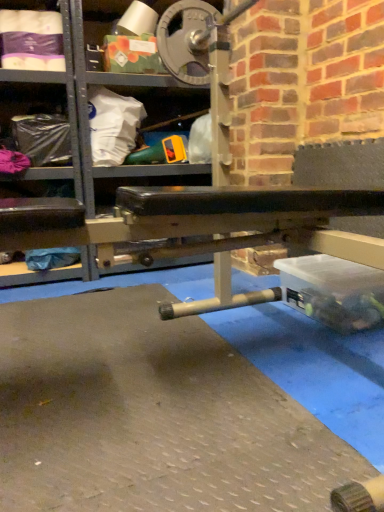
The image size is (384, 512). I want to click on black rubber bench at center, placed as the 1th shelf when sorted from right to left, so click(86, 114).

How much space does black rubber bench at center, placed as the 1th shelf when sorted from right to left, occupy horizontally?

The width of black rubber bench at center, placed as the 1th shelf when sorted from right to left, is 62.64 centimeters.

The width and height of the screenshot is (384, 512). What do you see at coordinates (86, 114) in the screenshot?
I see `black rubber bench at center, which is the second shelf in left-to-right order` at bounding box center [86, 114].

What is the approximate height of clear plastic bag at left, which ranks as the 2th shelf in right-to-left order?

clear plastic bag at left, which ranks as the 2th shelf in right-to-left order, is 11.15 inches in height.

Where is `clear plastic bag at left, which ranks as the 2th shelf in right-to-left order`? The height and width of the screenshot is (512, 384). clear plastic bag at left, which ranks as the 2th shelf in right-to-left order is located at coordinates (37, 121).

Measure the distance between point [29,158] and camera.

Point [29,158] is 1.96 meters from camera.

What do you see at coordinates (37, 121) in the screenshot? The height and width of the screenshot is (512, 384). I see `clear plastic bag at left, which ranks as the 2th shelf in right-to-left order` at bounding box center [37, 121].

Where is `black rubber bench at center, which is the second shelf in left-to-right order`? This screenshot has height=512, width=384. black rubber bench at center, which is the second shelf in left-to-right order is located at coordinates (86, 114).

In the scene shown: Can you confirm if black rubber bench at center, which is the second shelf in left-to-right order, is positioned to the left of clear plastic bag at left, which ranks as the 2th shelf in right-to-left order?

No.

Which object is further away from the camera taking this photo, black rubber bench at center, which is the second shelf in left-to-right order, or clear plastic bag at left, the 1th shelf when ordered from left to right?

clear plastic bag at left, the 1th shelf when ordered from left to right, is more distant.

Is point (51, 75) farther from viewer compared to point (13, 83)?

No, it is not.

From the image's perspective, is black rubber bench at center, which is the second shelf in left-to-right order, located above clear plastic bag at left, which ranks as the 2th shelf in right-to-left order?

Yes, from the image's perspective, black rubber bench at center, which is the second shelf in left-to-right order, is over clear plastic bag at left, which ranks as the 2th shelf in right-to-left order.

From a real-world perspective, is black rubber bench at center, placed as the 1th shelf when sorted from right to left, located higher than clear plastic bag at left, which ranks as the 2th shelf in right-to-left order?

Yes.

Between black rubber bench at center, placed as the 1th shelf when sorted from right to left, and clear plastic bag at left, which ranks as the 2th shelf in right-to-left order, which one has larger width?

Wider between the two is black rubber bench at center, placed as the 1th shelf when sorted from right to left.

Considering the sizes of black rubber bench at center, which is the second shelf in left-to-right order, and clear plastic bag at left, the 1th shelf when ordered from left to right, in the image, is black rubber bench at center, which is the second shelf in left-to-right order, taller or shorter than clear plastic bag at left, the 1th shelf when ordered from left to right,?

In the image, black rubber bench at center, which is the second shelf in left-to-right order, appears to be taller than clear plastic bag at left, the 1th shelf when ordered from left to right.

Considering the sizes of objects black rubber bench at center, which is the second shelf in left-to-right order, and clear plastic bag at left, which ranks as the 2th shelf in right-to-left order, in the image provided, who is smaller, black rubber bench at center, which is the second shelf in left-to-right order, or clear plastic bag at left, which ranks as the 2th shelf in right-to-left order,?

With smaller size is clear plastic bag at left, which ranks as the 2th shelf in right-to-left order.

Is black rubber bench at center, which is the second shelf in left-to-right order, not inside clear plastic bag at left, which ranks as the 2th shelf in right-to-left order?

Yes.

Is black rubber bench at center, placed as the 1th shelf when sorted from right to left, oriented away from clear plastic bag at left, which ranks as the 2th shelf in right-to-left order?

No, black rubber bench at center, placed as the 1th shelf when sorted from right to left, is not facing the opposite direction of clear plastic bag at left, which ranks as the 2th shelf in right-to-left order.

Identify the location of shelf lying on the right of clear plastic bag at left, the 1th shelf when ordered from left to right. The image size is (384, 512). (86, 114).

Would you say clear plastic bag at left, which ranks as the 2th shelf in right-to-left order, is to the left or to the right of black rubber bench at center, which is the second shelf in left-to-right order, in the picture?

clear plastic bag at left, which ranks as the 2th shelf in right-to-left order, is positioned on black rubber bench at center, which is the second shelf in left-to-right order,'s left side.

In the scene shown: Which object is further away from the camera taking this photo, clear plastic bag at left, the 1th shelf when ordered from left to right, or black rubber bench at center, placed as the 1th shelf when sorted from right to left?

clear plastic bag at left, the 1th shelf when ordered from left to right, is further away from the camera.

Does point (49, 161) lie behind point (40, 79)?

Yes, it is behind point (40, 79).

From the image's perspective, relative to black rubber bench at center, which is the second shelf in left-to-right order, is clear plastic bag at left, which ranks as the 2th shelf in right-to-left order, above or below?

clear plastic bag at left, which ranks as the 2th shelf in right-to-left order, is below black rubber bench at center, which is the second shelf in left-to-right order.

From a real-world perspective, is clear plastic bag at left, which ranks as the 2th shelf in right-to-left order, positioned above or below black rubber bench at center, which is the second shelf in left-to-right order?

A: clear plastic bag at left, which ranks as the 2th shelf in right-to-left order, is below black rubber bench at center, which is the second shelf in left-to-right order.

Which object is wider, clear plastic bag at left, the 1th shelf when ordered from left to right, or black rubber bench at center, which is the second shelf in left-to-right order?

black rubber bench at center, which is the second shelf in left-to-right order.

Considering the relative sizes of clear plastic bag at left, which ranks as the 2th shelf in right-to-left order, and black rubber bench at center, placed as the 1th shelf when sorted from right to left, in the image provided, is clear plastic bag at left, which ranks as the 2th shelf in right-to-left order, shorter than black rubber bench at center, placed as the 1th shelf when sorted from right to left,?

Indeed, clear plastic bag at left, which ranks as the 2th shelf in right-to-left order, has a lesser height compared to black rubber bench at center, placed as the 1th shelf when sorted from right to left.

Does clear plastic bag at left, which ranks as the 2th shelf in right-to-left order, have a smaller size compared to black rubber bench at center, placed as the 1th shelf when sorted from right to left?

Yes, clear plastic bag at left, which ranks as the 2th shelf in right-to-left order, is smaller than black rubber bench at center, placed as the 1th shelf when sorted from right to left.

Which is correct: clear plastic bag at left, the 1th shelf when ordered from left to right, is inside black rubber bench at center, which is the second shelf in left-to-right order, or outside of it?

clear plastic bag at left, the 1th shelf when ordered from left to right, lies outside black rubber bench at center, which is the second shelf in left-to-right order.

Is clear plastic bag at left, the 1th shelf when ordered from left to right, far away from black rubber bench at center, which is the second shelf in left-to-right order?

No, there isn't a large distance between clear plastic bag at left, the 1th shelf when ordered from left to right, and black rubber bench at center, which is the second shelf in left-to-right order.

Is clear plastic bag at left, the 1th shelf when ordered from left to right, oriented away from black rubber bench at center, which is the second shelf in left-to-right order?

No, black rubber bench at center, which is the second shelf in left-to-right order, is not at the back of clear plastic bag at left, the 1th shelf when ordered from left to right.

What's the angular difference between clear plastic bag at left, which ranks as the 2th shelf in right-to-left order, and black rubber bench at center, placed as the 1th shelf when sorted from right to left,'s facing directions?

The angular difference between clear plastic bag at left, which ranks as the 2th shelf in right-to-left order, and black rubber bench at center, placed as the 1th shelf when sorted from right to left, is 0.898 degrees.

Identify the location of shelf to the right of clear plastic bag at left, which ranks as the 2th shelf in right-to-left order. This screenshot has width=384, height=512. (86, 114).

At what (x,y) coordinates should I click in order to perform the action: click on shelf on the right of clear plastic bag at left, the 1th shelf when ordered from left to right. Please return your answer as a coordinate pair (x, y). The width and height of the screenshot is (384, 512). Looking at the image, I should click on (86, 114).

The height and width of the screenshot is (512, 384). I want to click on shelf behind the black rubber bench at center, placed as the 1th shelf when sorted from right to left, so click(37, 121).